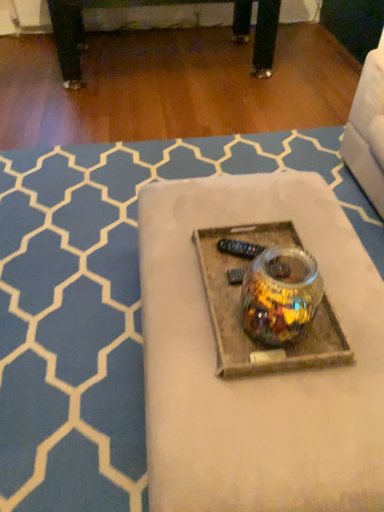
Where is `vacant space underneath translucent glass jar at center (from a real-world perspective)`? The width and height of the screenshot is (384, 512). vacant space underneath translucent glass jar at center (from a real-world perspective) is located at coordinates (97, 260).